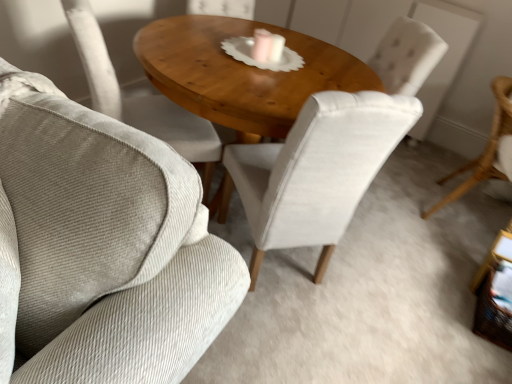
Question: Is the surface of woven wicker side table at lower right in direct contact with light beige fabric chair at center, which ranks as the third chair in right-to-left order?

Choices:
 (A) no
 (B) yes

Answer: (A)

Question: From a real-world perspective, is woven wicker side table at lower right positioned over light beige fabric chair at center, which is counted as the first chair, starting from the left, based on gravity?

Choices:
 (A) yes
 (B) no

Answer: (B)

Question: Does woven wicker side table at lower right have a greater width compared to light beige fabric chair at center, which ranks as the third chair in right-to-left order?

Choices:
 (A) yes
 (B) no

Answer: (B)

Question: Could you tell me if woven wicker side table at lower right is facing light beige fabric chair at center, which ranks as the third chair in right-to-left order?

Choices:
 (A) no
 (B) yes

Answer: (A)

Question: Does woven wicker side table at lower right appear on the right side of light beige fabric chair at center, which is counted as the first chair, starting from the left?

Choices:
 (A) no
 (B) yes

Answer: (B)

Question: From the image's perspective, relative to light beige fabric chair at center, which ranks as the third chair in right-to-left order, is velvet white chair at center, placed as the 2th chair when sorted from left to right, above or below?

Choices:
 (A) above
 (B) below

Answer: (B)

Question: Is velvet white chair at center, placed as the 2th chair when sorted from left to right, bigger or smaller than light beige fabric chair at center, which is counted as the first chair, starting from the left?

Choices:
 (A) big
 (B) small

Answer: (A)

Question: From their relative heights in the image, would you say velvet white chair at center, which ranks as the 2th chair in right-to-left order, is taller or shorter than light beige fabric chair at center, which ranks as the third chair in right-to-left order?

Choices:
 (A) short
 (B) tall

Answer: (B)

Question: From a real-world perspective, relative to light beige fabric chair at center, which is counted as the first chair, starting from the left, is velvet white chair at center, placed as the 2th chair when sorted from left to right, vertically above or below?

Choices:
 (A) above
 (B) below

Answer: (B)

Question: Is light brown wicker chair at right, positioned as the 3th chair in left-to-right order, bigger or smaller than wooden polished table at center?

Choices:
 (A) small
 (B) big

Answer: (A)

Question: Is point (500, 89) closer or farther from the camera than point (198, 51)?

Choices:
 (A) closer
 (B) farther

Answer: (B)

Question: Is light brown wicker chair at right, positioned as the 3th chair in left-to-right order, to the left or to the right of wooden polished table at center in the image?

Choices:
 (A) right
 (B) left

Answer: (A)

Question: Considering their positions, is light brown wicker chair at right, positioned as the 3th chair in left-to-right order, located in front of or behind wooden polished table at center?

Choices:
 (A) front
 (B) behind

Answer: (B)

Question: From a real-world perspective, is woven wicker side table at lower right above or below light brown wicker chair at right, positioned as the 3th chair in left-to-right order?

Choices:
 (A) above
 (B) below

Answer: (B)

Question: In terms of size, does woven wicker side table at lower right appear bigger or smaller than light brown wicker chair at right, positioned as the 3th chair in left-to-right order?

Choices:
 (A) small
 (B) big

Answer: (A)